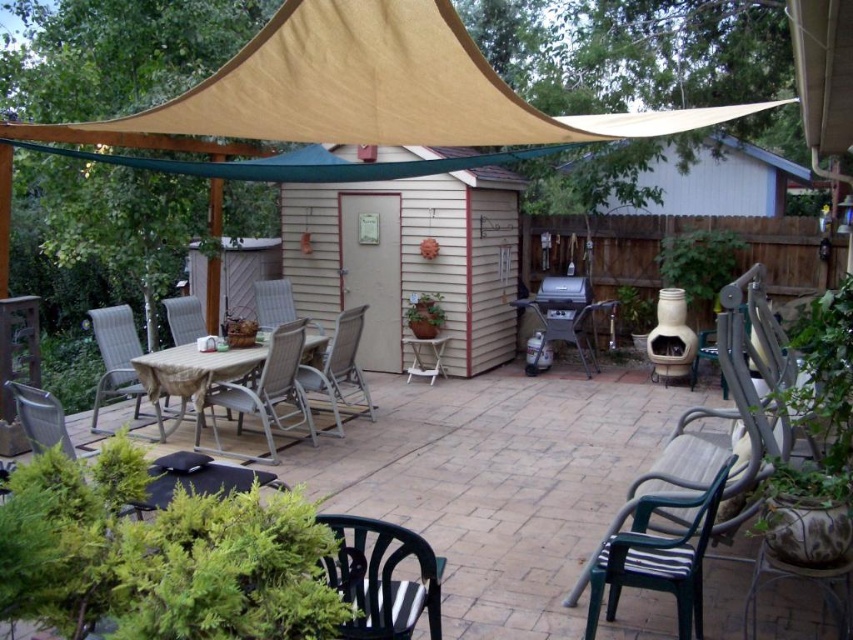
Question: Which point appears closest to the camera in this image?

Choices:
 (A) (190, 323)
 (B) (192, 369)
 (C) (65, 435)
 (D) (103, 340)

Answer: (C)

Question: Is beige canvas canopy at upper center positioned before woven plastic chair at center?

Choices:
 (A) yes
 (B) no

Answer: (A)

Question: Which is farther from the matte plastic chair at center?

Choices:
 (A) metallic silver chair at center
 (B) black plastic chair at lower left

Answer: (B)

Question: Which point is farther to the camera?

Choices:
 (A) matte plastic chair at center
 (B) beige fabric-covered table at center
 (C) matte gray plastic chair at center

Answer: (C)

Question: Does beige canvas canopy at upper center appear under woven plastic chair at center?

Choices:
 (A) no
 (B) yes

Answer: (A)

Question: Does matte plastic chair at center appear on the left side of metallic silver chair at center?

Choices:
 (A) yes
 (B) no

Answer: (A)